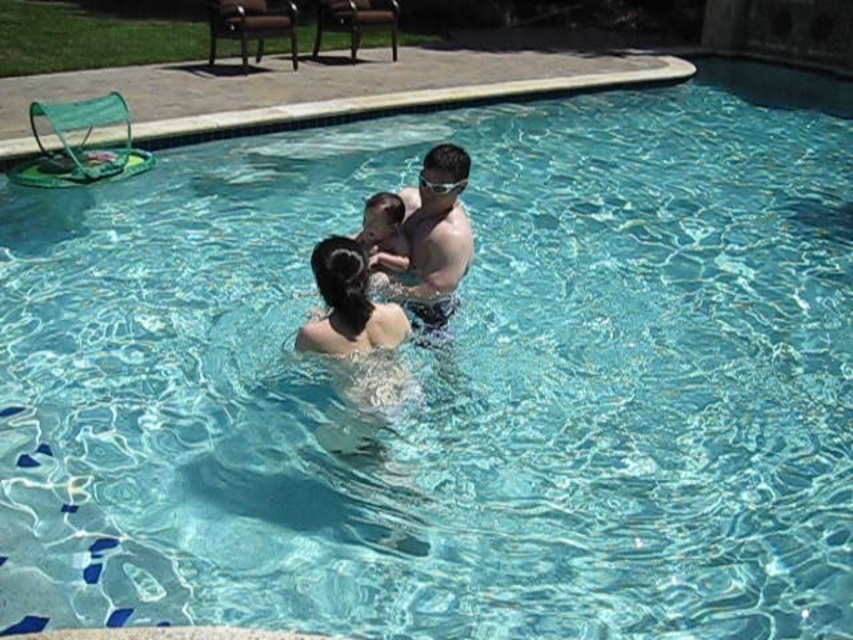
Who is taller, smooth skin child at center or clear plastic goggles at upper center?

Standing taller between the two is smooth skin child at center.

How distant is smooth skin child at center from clear plastic goggles at upper center?

They are 34.12 centimeters apart.

Which is behind, point (370, 266) or point (433, 182)?

Point (370, 266)

Identify the location of smooth skin child at center. The width and height of the screenshot is (853, 640). (383, 234).

Is smooth white hair at center above smooth skin child at center?

Incorrect, smooth white hair at center is not positioned above smooth skin child at center.

Is smooth white hair at center shorter than smooth skin child at center?

Incorrect, smooth white hair at center's height does not fall short of smooth skin child at center's.

Is point (329, 243) closer to camera compared to point (392, 234)?

That is True.

You are a GUI agent. You are given a task and a screenshot of the screen. Output one action in this format:
    pyautogui.click(x=<x>, y=<y>)
    Task: Click on the smooth white hair at center
    This screenshot has width=853, height=640.
    Given the screenshot: What is the action you would take?
    pyautogui.click(x=347, y=305)

Does smooth skin man at center appear on the left side of smooth skin child at center?

No, smooth skin man at center is not to the left of smooth skin child at center.

Does smooth skin man at center come behind smooth skin child at center?

No, smooth skin man at center is in front of smooth skin child at center.

Between point (439, 228) and point (404, 250), which one is positioned behind?

Point (404, 250)

Identify the location of smooth skin man at center. Image resolution: width=853 pixels, height=640 pixels. click(x=434, y=237).